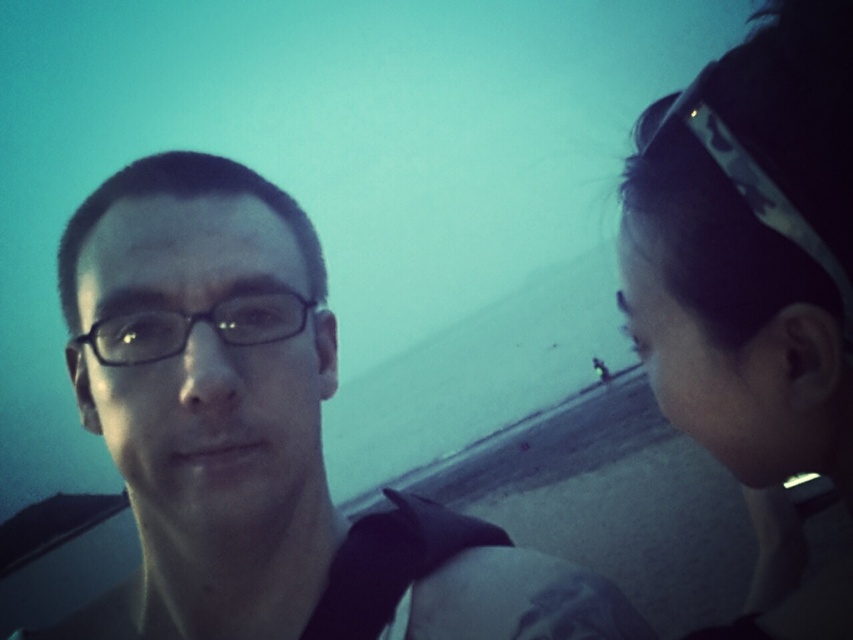
You are using a drone to take a photo of the scene. The drone has a camera that can focus on objects within a 0.3 unit radius. If the drone is currently at position point A, which is at coordinates point A is at point 0.452, 0.887, can the drone capture the camouflage headband at upper right in focus?

The camouflage headband at upper right is located at point (x=756, y=289). Since the drone is at point A which shares the same coordinates, the distance between them is 0 units, which is within the 0.3 unit radius. Therefore, the drone can capture the camouflage headband at upper right in focus.

You are a photographer trying to capture a closeup shot of the matte black glasses at left and the camouflage headband at upper right in the image. Your camera has a maximum focus range of 10 inches. Can you fit both objects within the focus range without moving the camera?

The matte black glasses at left and camouflage headband at upper right are 10.35 inches apart, which exceeds the camera focus range of 10 inches. Therefore, you cannot fit both objects within the focus range without moving the camera.

Consider the image. You are a photographer adjusting your camera settings to capture the two individuals in the scene. You notice the camouflage headband at upper right and the black plastic glasses at left. Which object is closer to the camera?

The camouflage headband at upper right is closer to the camera because it is in front of the black plastic glasses at left.